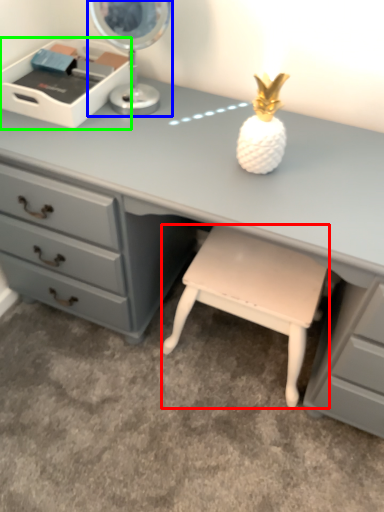
Question: Which object is positioned farthest from stool (highlighted by a red box)? Select from table lamp (highlighted by a blue box) and writing desk (highlighted by a green box).

Choices:
 (A) table lamp
 (B) writing desk

Answer: (B)